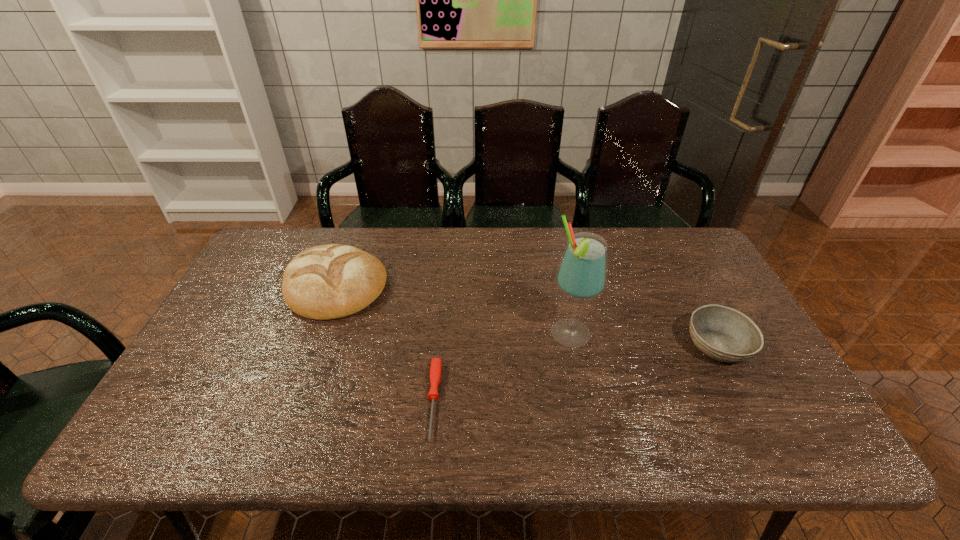
Where is `vacant area at the near right corner`? This screenshot has width=960, height=540. vacant area at the near right corner is located at coordinates [x=800, y=443].

This screenshot has height=540, width=960. What are the coordinates of `vacant space that is in between the tallest object and the leftmost object` in the screenshot? It's located at (453, 310).

Find the location of `free space between the second object from left to right and the bowl`. free space between the second object from left to right and the bowl is located at coordinates (576, 373).

At what (x,y) coordinates should I click in order to perform the action: click on free space between the third shortest object and the shortest object. Please return your answer as a coordinate pair (x, y). The image size is (960, 540). Looking at the image, I should click on (385, 343).

At what (x,y) coordinates should I click in order to perform the action: click on vacant space that is in between the shortest object and the leftmost object. Please return your answer as a coordinate pair (x, y). Looking at the image, I should click on (385, 343).

Where is `vacant space that is in between the third shortest object and the alcohol`? vacant space that is in between the third shortest object and the alcohol is located at coordinates point(453,310).

Where is `free space between the bread and the bowl`? The image size is (960, 540). free space between the bread and the bowl is located at coordinates (526, 316).

Where is `free area in between the second object from left to right and the second object from right to left`? free area in between the second object from left to right and the second object from right to left is located at coordinates (502, 367).

Where is `vacant region between the rightmost object and the shortest object`? This screenshot has height=540, width=960. vacant region between the rightmost object and the shortest object is located at coordinates (576, 373).

Where is `free space between the shortest object and the third object from left to right`? free space between the shortest object and the third object from left to right is located at coordinates (502, 367).